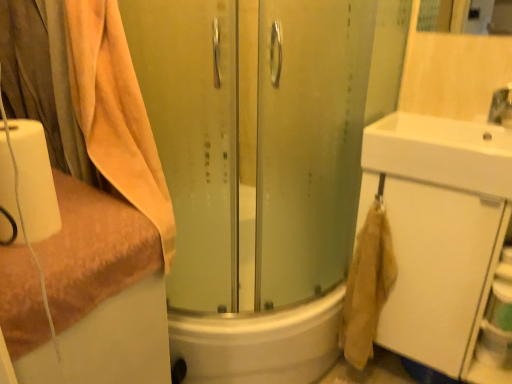
Question: From the image's perspective, is white matte toilet paper at left located above beige cotton towel at left, acting as the first towel starting from the top?

Choices:
 (A) yes
 (B) no

Answer: (B)

Question: Does white matte toilet paper at left have a larger size compared to beige cotton towel at left, acting as the first towel starting from the top?

Choices:
 (A) no
 (B) yes

Answer: (A)

Question: Does white matte toilet paper at left touch beige cotton towel at left, acting as the first towel starting from the top?

Choices:
 (A) no
 (B) yes

Answer: (A)

Question: Does white matte toilet paper at left come behind beige cotton towel at left, acting as the 2th towel starting from the bottom?

Choices:
 (A) yes
 (B) no

Answer: (B)

Question: Is white matte toilet paper at left thinner than beige cotton towel at left, acting as the first towel starting from the top?

Choices:
 (A) no
 (B) yes

Answer: (B)

Question: Can you confirm if white matte toilet paper at left is taller than beige cotton towel at left, acting as the first towel starting from the top?

Choices:
 (A) no
 (B) yes

Answer: (A)

Question: Considering the relative sizes of white glossy sink at upper right and white matte toilet paper at left in the image provided, is white glossy sink at upper right smaller than white matte toilet paper at left?

Choices:
 (A) yes
 (B) no

Answer: (B)

Question: Considering the relative positions of white glossy sink at upper right and white matte toilet paper at left in the image provided, is white glossy sink at upper right to the left of white matte toilet paper at left from the viewer's perspective?

Choices:
 (A) yes
 (B) no

Answer: (B)

Question: Is white glossy sink at upper right thinner than white matte toilet paper at left?

Choices:
 (A) yes
 (B) no

Answer: (B)

Question: From a real-world perspective, is white glossy sink at upper right under white matte toilet paper at left?

Choices:
 (A) no
 (B) yes

Answer: (B)

Question: Can you confirm if white glossy sink at upper right is wider than white matte toilet paper at left?

Choices:
 (A) yes
 (B) no

Answer: (A)

Question: From the image's perspective, is white glossy sink at upper right on top of white matte toilet paper at left?

Choices:
 (A) no
 (B) yes

Answer: (B)

Question: From the image's perspective, is white matte toilet paper at left below beige cotton towel at lower right?

Choices:
 (A) no
 (B) yes

Answer: (A)